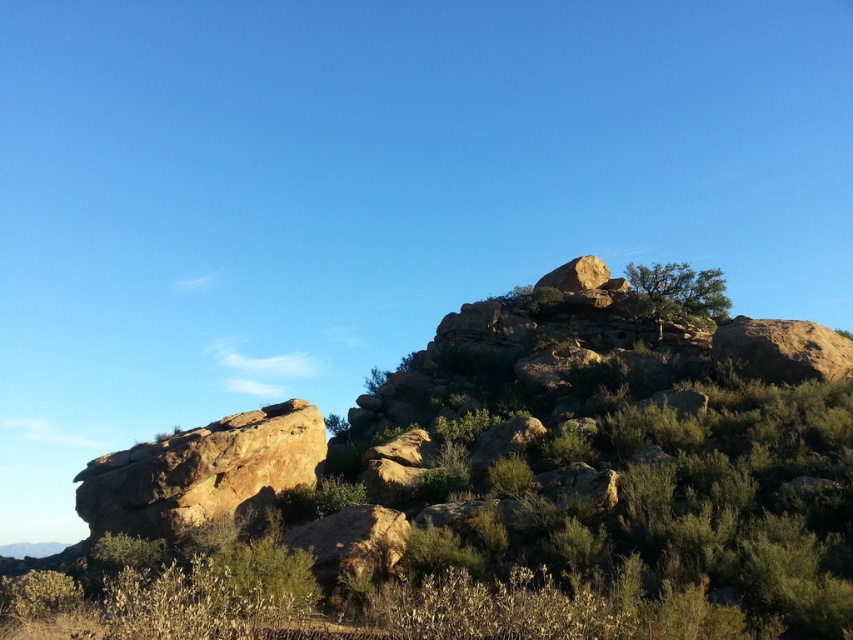
Question: Among these objects, which one is farthest from the camera?

Choices:
 (A) brown rough rock at left
 (B) green leafy shrubs at upper center

Answer: (A)

Question: Observing the image, what is the correct spatial positioning of green leafy shrubs at upper center in reference to brown rough rock at left?

Choices:
 (A) left
 (B) right

Answer: (B)

Question: Does green leafy bush at upper right have a lesser width compared to rustic stone boulder at upper center?

Choices:
 (A) yes
 (B) no

Answer: (A)

Question: Can you confirm if green leafy shrubs at upper center is positioned to the right of rustic stone boulder at upper center?

Choices:
 (A) no
 (B) yes

Answer: (A)

Question: Which point is farther to the camera?

Choices:
 (A) (679, 308)
 (B) (239, 480)

Answer: (A)

Question: Which of the following is the farthest from the observer?

Choices:
 (A) (653, 262)
 (B) (583, 262)

Answer: (A)